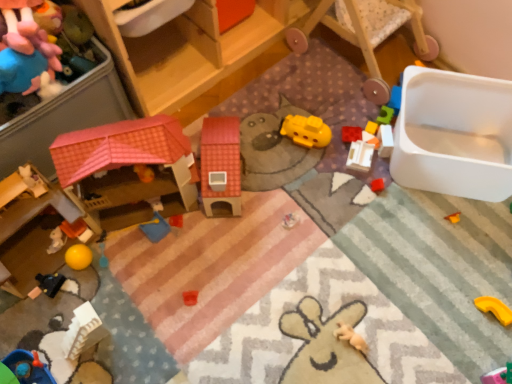
Find the location of a particular element. This screenshot has height=384, width=512. free area in between yellow rubber toy at lower right, which ranks as the 1th toy in right-to-left order, and black matte toy car at lower left, arranged as the 2th toy when viewed from the left is located at coordinates (284, 299).